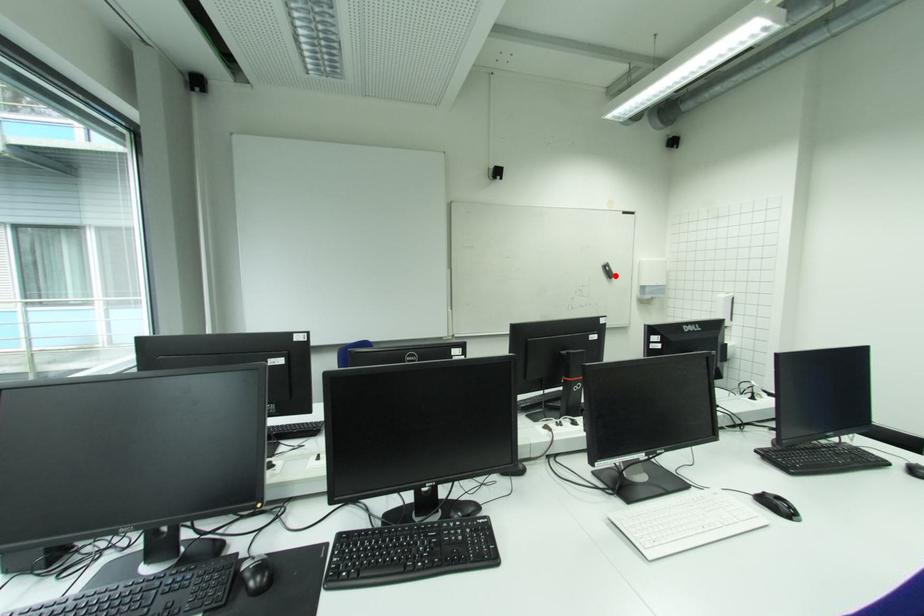
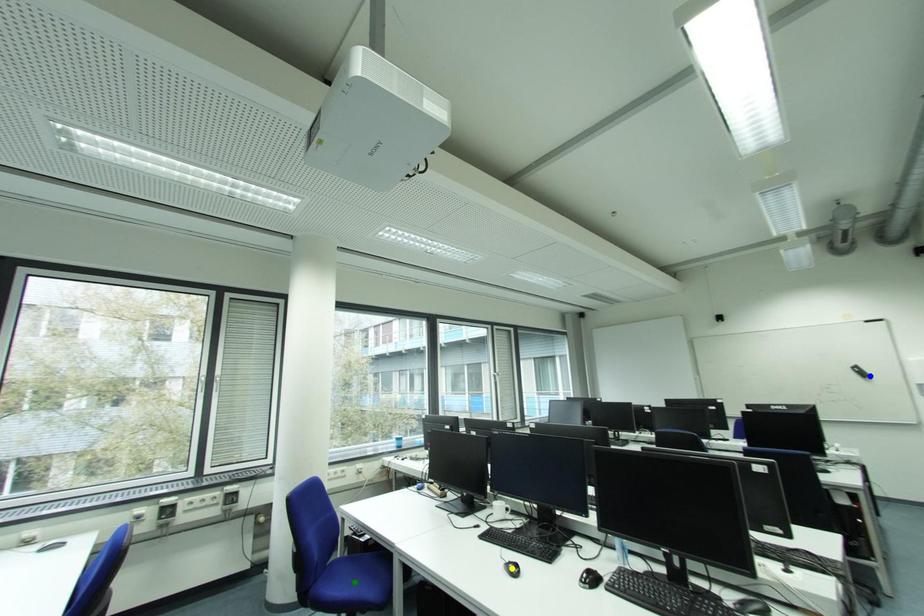
Question: I am providing you with two images of the same scene from different viewpoints. A red point is marked on the first image. You are given multiple points on the second image. In image 2, which mark is for the same physical point as the one in image 1?

Choices:
 (A) yellow point
 (B) blue point
 (C) green point

Answer: (B)